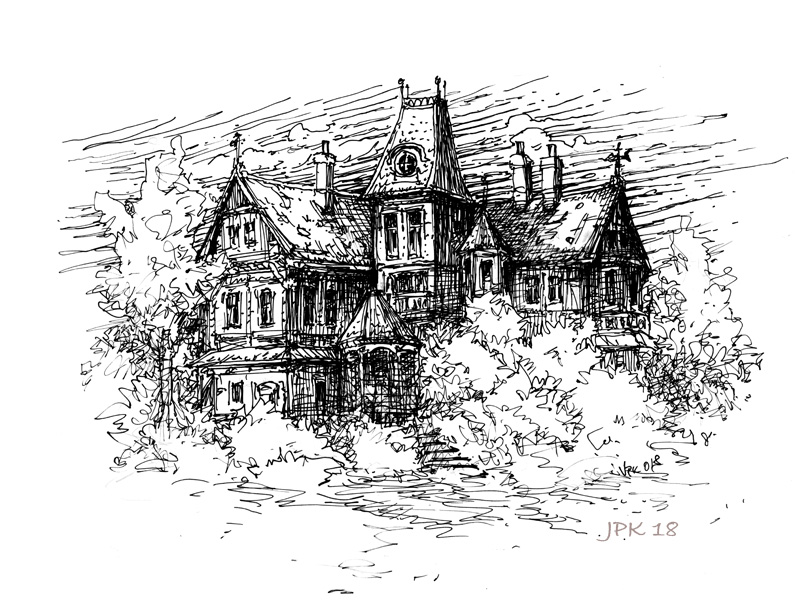
This screenshot has width=800, height=605. I want to click on chimneys, so click(x=550, y=187), click(x=521, y=177), click(x=326, y=172).